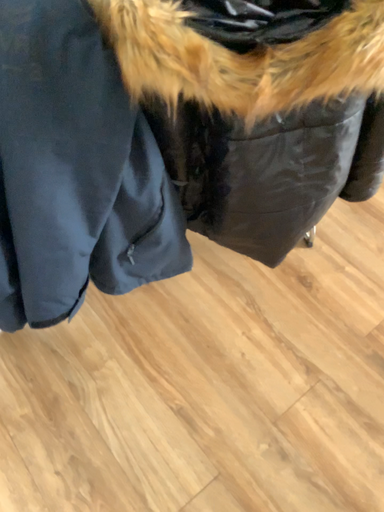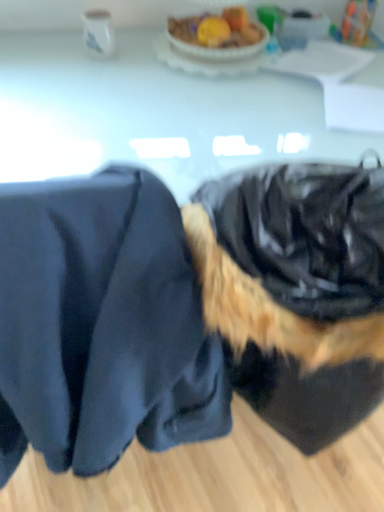
Question: How did the camera likely rotate when shooting the video?

Choices:
 (A) rotated downward
 (B) rotated upward

Answer: (B)